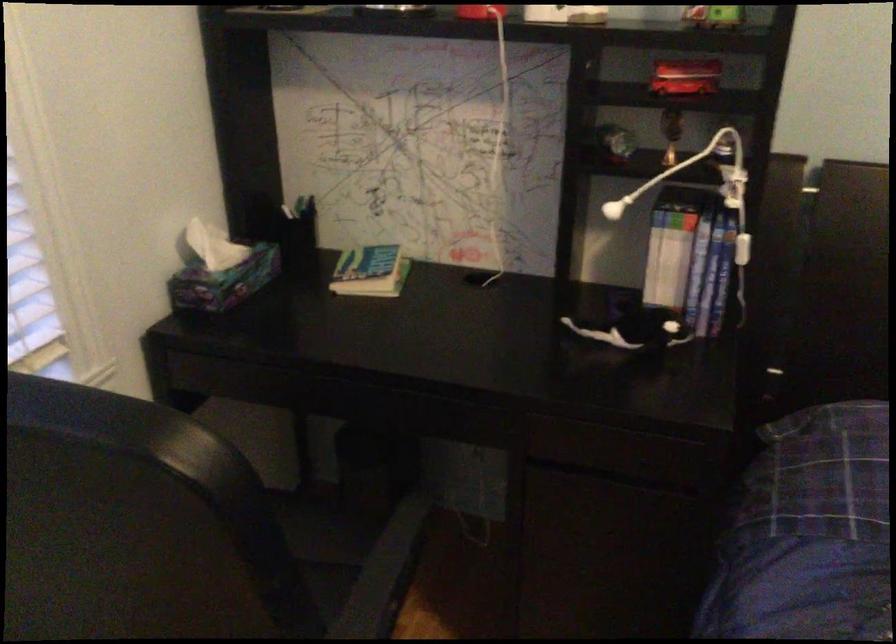
Where is `white lamp head`? white lamp head is located at coordinates (688, 174).